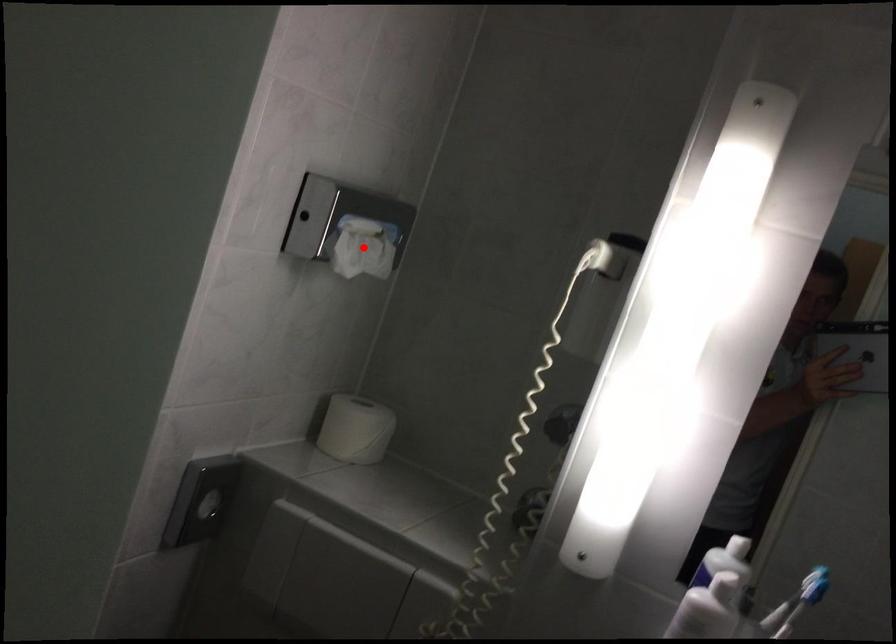
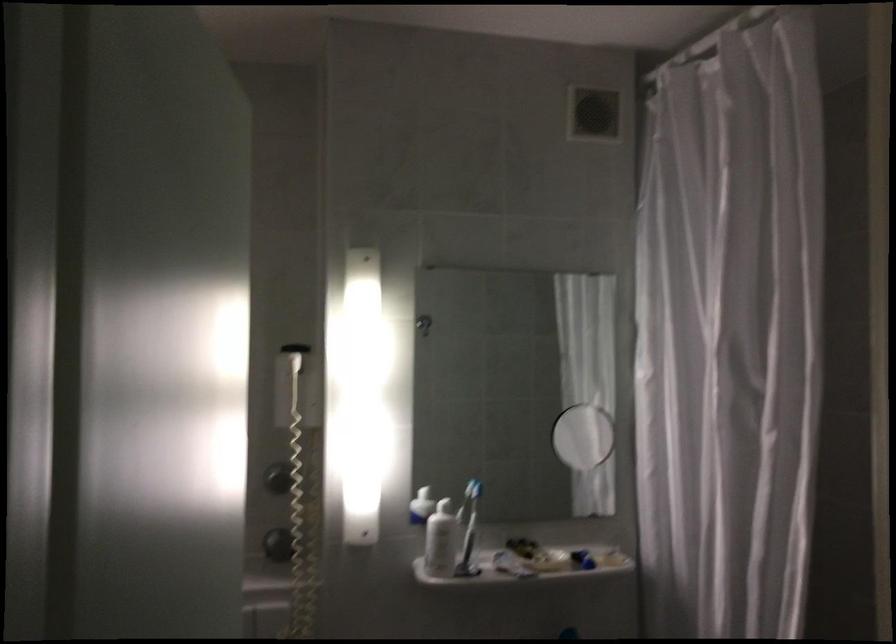
Question: I am providing you with two images of the same scene from different viewpoints. A red point is marked on the first image. At the location where the point appears in image 1, is it still visible in image 2?

Choices:
 (A) Yes
 (B) No

Answer: (B)